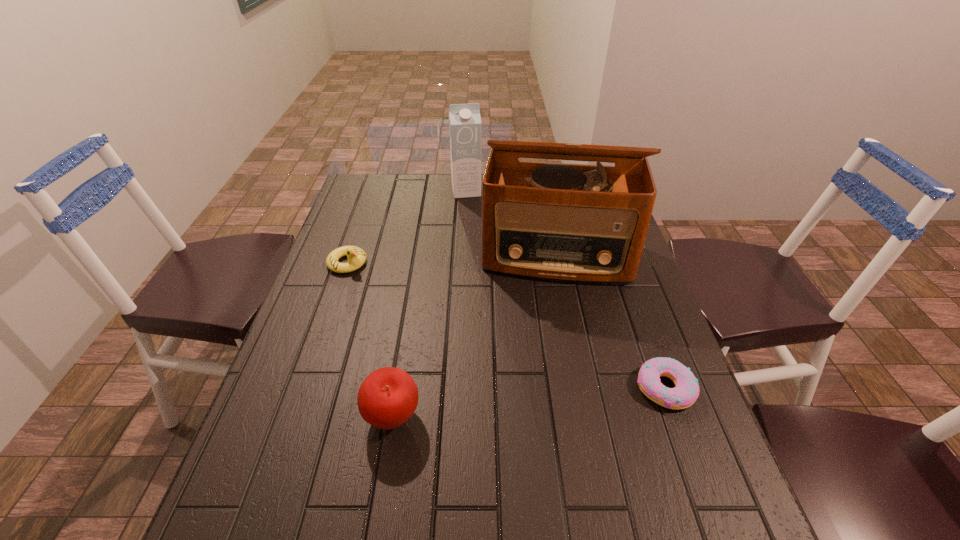
Image resolution: width=960 pixels, height=540 pixels. I want to click on free space between the second object from left to right and the doughnut, so click(x=528, y=402).

I want to click on free area in between the doughnut and the carton, so click(x=565, y=289).

The width and height of the screenshot is (960, 540). Find the location of `free space that is in between the third tallest object and the carton`. free space that is in between the third tallest object and the carton is located at coordinates (430, 303).

Find the location of a particular element. vacant region between the leftmost object and the fourth object from right to left is located at coordinates (370, 340).

Identify the location of unoccupied area between the doughnut and the leftmost object. The width and height of the screenshot is (960, 540). (506, 325).

Identify the location of free space between the tallest object and the second shortest object. The image size is (960, 540). (452, 259).

Image resolution: width=960 pixels, height=540 pixels. Find the location of `vacant region between the apple and the radio receiver`. vacant region between the apple and the radio receiver is located at coordinates (475, 336).

I want to click on free space between the duckling and the apple, so click(x=370, y=340).

Where is `empty space that is in between the apple and the shortest object`? This screenshot has height=540, width=960. empty space that is in between the apple and the shortest object is located at coordinates (528, 402).

Where is `object identified as the fourth closest to the farthest object`? object identified as the fourth closest to the farthest object is located at coordinates (686, 391).